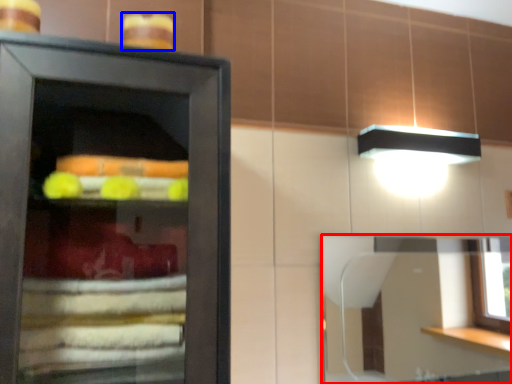
Question: Among these objects, which one is nearest to the camera, mirror (highlighted by a red box) or food (highlighted by a blue box)?

Choices:
 (A) mirror
 (B) food

Answer: (B)